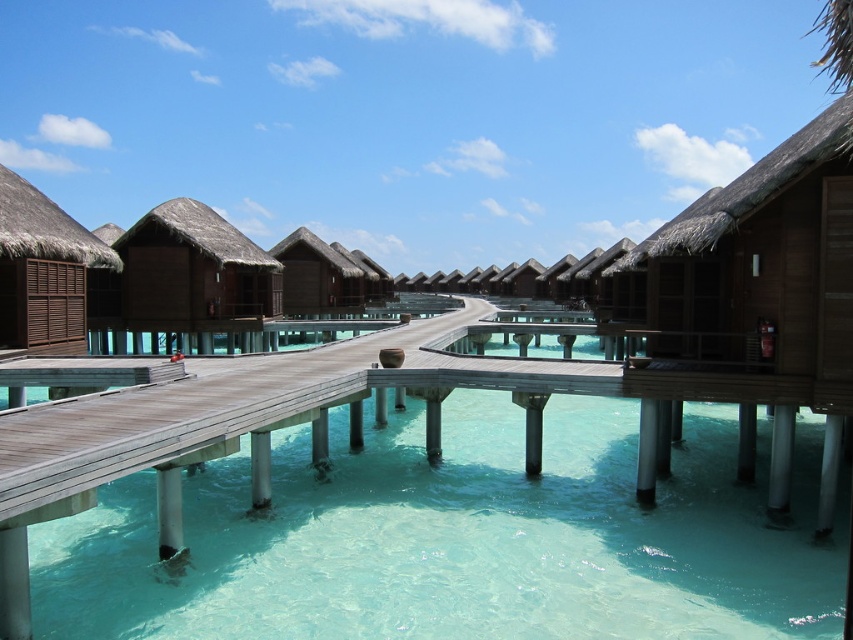
Does clear turquoise water at center have a lesser width compared to brown thatched roof hut at center?

Incorrect, clear turquoise water at center's width is not less than brown thatched roof hut at center's.

Is clear turquoise water at center closer to the viewer compared to brown thatched roof hut at center?

Yes, clear turquoise water at center is closer to the viewer.

Between point (389, 477) and point (317, 268), which one is positioned in front?

Point (389, 477) is more forward.

Where is `clear turquoise water at center`? The height and width of the screenshot is (640, 853). clear turquoise water at center is located at coordinates (410, 516).

In the scene shown: Between matte brown hut at center and brown wooden hut at left, which one appears on the left side from the viewer's perspective?

matte brown hut at center

Between point (184, 224) and point (38, 310), which one is positioned behind?

The point (184, 224) is behind.

Which is behind, point (155, 300) or point (20, 205)?

The point (155, 300) is behind.

The width and height of the screenshot is (853, 640). Identify the location of matte brown hut at center. (194, 273).

Between brown wooden hut at left and brown thatched roof hut at center, which one has less height?

Standing shorter between the two is brown wooden hut at left.

Does brown wooden hut at left have a lesser width compared to brown thatched roof hut at center?

Correct, brown wooden hut at left's width is less than brown thatched roof hut at center's.

Between point (33, 220) and point (358, 273), which one is positioned behind?

Positioned behind is point (358, 273).

The height and width of the screenshot is (640, 853). In order to click on brown wooden hut at left in this screenshot , I will do `click(44, 269)`.